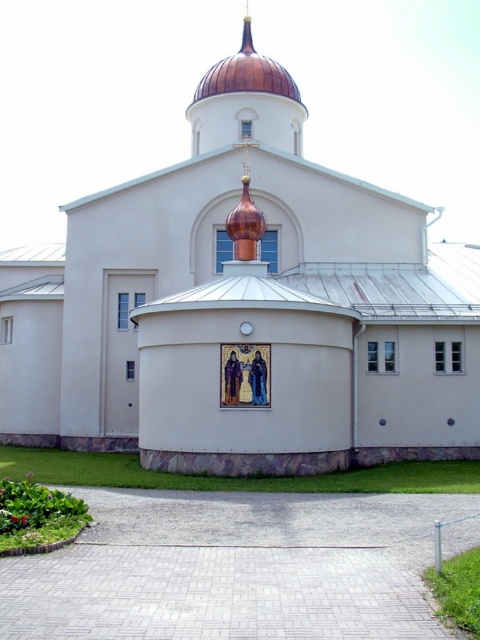
Question: Which point is farther from the camera taking this photo?

Choices:
 (A) (292, 148)
 (B) (333, 388)

Answer: (A)

Question: Among these points, which one is farthest from the camera?

Choices:
 (A) (256, 116)
 (B) (247, 124)

Answer: (A)

Question: Can you confirm if white matte church at center is positioned to the right of copper dome at upper center?

Choices:
 (A) yes
 (B) no

Answer: (B)

Question: Which point is farther to the camera?

Choices:
 (A) (238, 61)
 (B) (13, 417)

Answer: (A)

Question: Does white matte church at center have a larger size compared to copper dome at upper center?

Choices:
 (A) no
 (B) yes

Answer: (B)

Question: Is white matte church at center above copper dome at upper center?

Choices:
 (A) no
 (B) yes

Answer: (A)